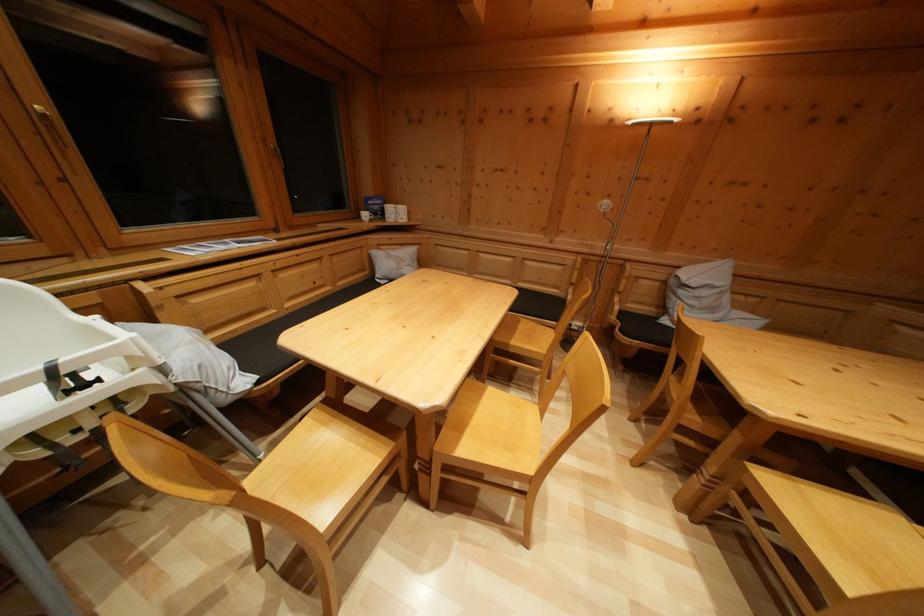
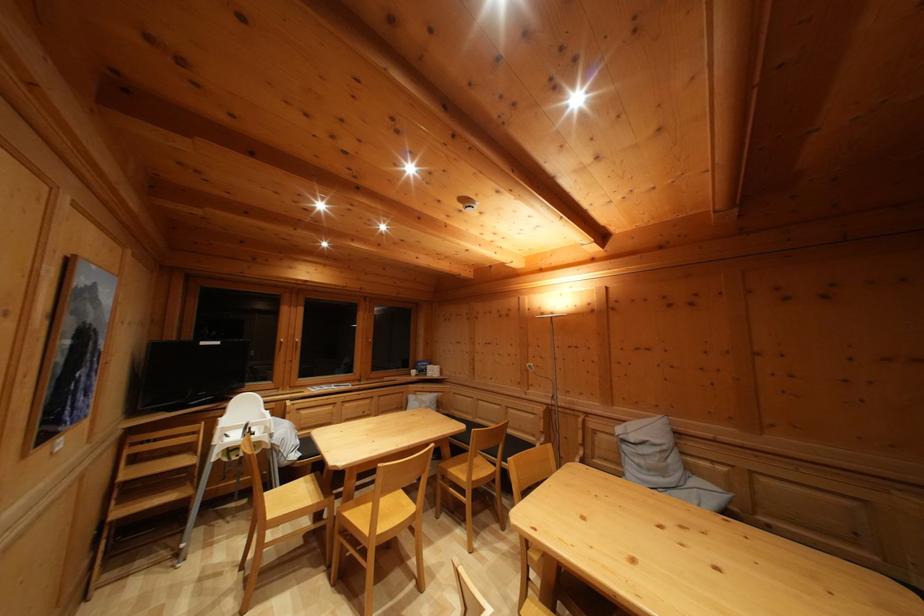
Locate, in the second image, the point that corresponds to [687,299] in the first image.

(629, 454)